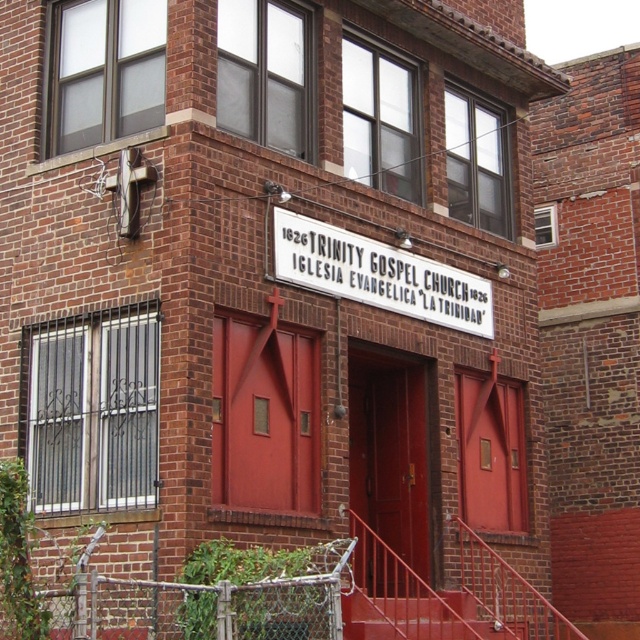
You are standing in front of Trinity Gospel Church and want to read the white plastic sign at center. However, there is a metallic red staircase at center in your way. Can you walk around the staircase to reach the sign?

The white plastic sign at center is much taller than the metallic red staircase at center, so you can walk around the staircase and still see the sign from below.

You are standing in front of Trinity Gospel Church and want to locate the sign that has the church name in both English and Spanish. According to the image, where exactly is the white plastic sign at center positioned?

The white plastic sign at center is located at point (378,275), so it is positioned at that coordinate.